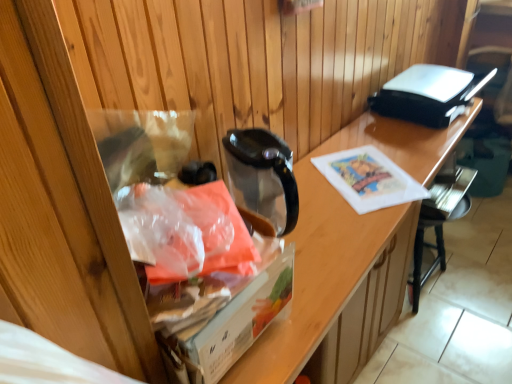
Question: Looking at their shapes, would you say black plastic chair at lower right is wider or thinner than transparent plastic bag at left?

Choices:
 (A) wide
 (B) thin

Answer: (B)

Question: Is black plastic chair at lower right taller or shorter than transparent plastic bag at left?

Choices:
 (A) tall
 (B) short

Answer: (B)

Question: Which of these objects is positioned closest to the transparent plastic bag at left?

Choices:
 (A) translucent plastic bag at left
 (B) black plastic toaster at upper right
 (C) black plastic chair at lower right

Answer: (B)

Question: Based on their relative distances, which object is nearer to the black plastic toaster at upper right?

Choices:
 (A) black plastic chair at lower right
 (B) translucent plastic bag at left
 (C) transparent plastic bag at left

Answer: (C)